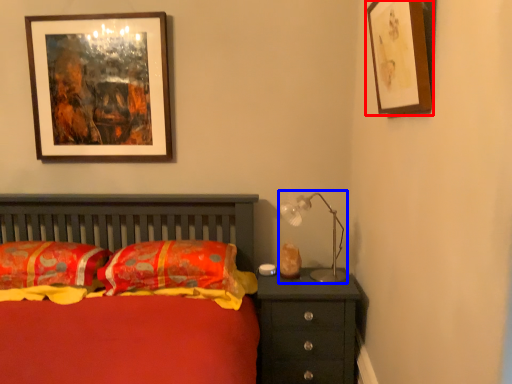
Question: Which of the following is the closest to the observer, picture frame (highlighted by a red box) or table lamp (highlighted by a blue box)?

Choices:
 (A) picture frame
 (B) table lamp

Answer: (A)